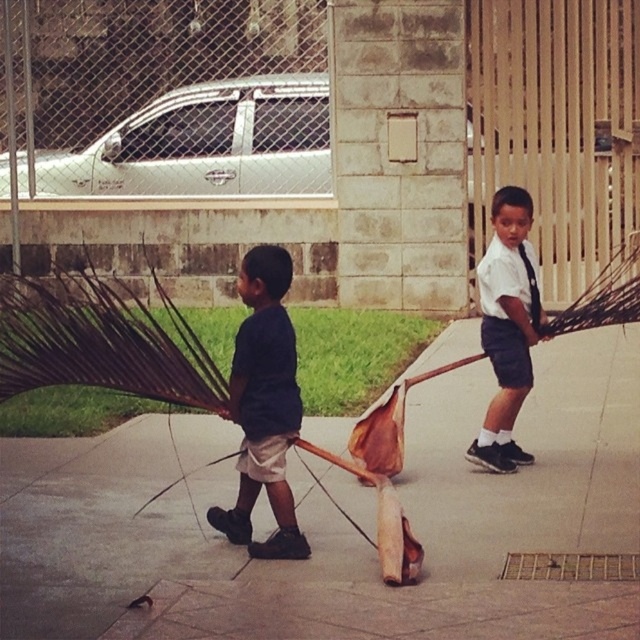
You are a delivery person trying to deliver a package to the address shown in the image. The recipient mentioned they will be standing on the brown concrete pavement at center. Based on the image, where should you look for the recipient relative to the dark blue shirt at center?

The recipient is standing on the brown concrete pavement at center, which is below the dark blue shirt at center. Therefore, the recipient is located below the dark blue shirt at center.